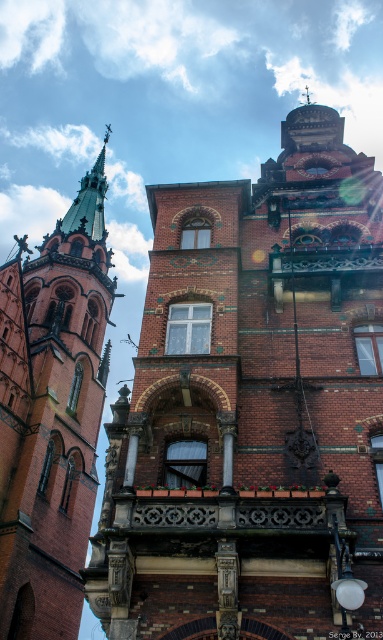
Question: In this image, where is brick building at center located relative to brick spire at left?

Choices:
 (A) left
 (B) right

Answer: (B)

Question: Among these points, which one is nearest to the camera?

Choices:
 (A) (39, 497)
 (B) (265, 342)

Answer: (B)

Question: Which point is closer to the camera taking this photo?

Choices:
 (A) (81, 588)
 (B) (175, 330)

Answer: (B)

Question: Does brick building at center appear on the left side of brick spire at left?

Choices:
 (A) no
 (B) yes

Answer: (A)

Question: Which object appears closest to the camera in this image?

Choices:
 (A) brick spire at left
 (B) brick building at center

Answer: (B)

Question: Is brick building at center to the left of brick spire at left from the viewer's perspective?

Choices:
 (A) yes
 (B) no

Answer: (B)